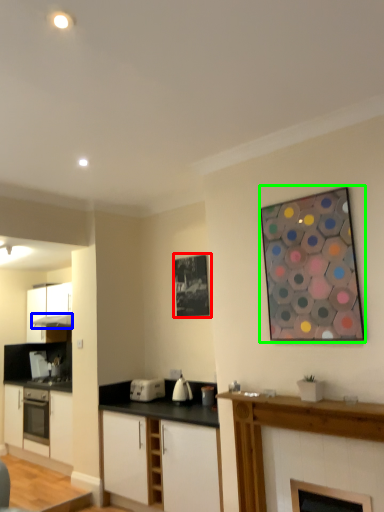
Question: Which object is the closest to the picture frame (highlighted by a red box)? Choose among these: exhaust hood (highlighted by a blue box) or picture frame (highlighted by a green box).

Choices:
 (A) exhaust hood
 (B) picture frame

Answer: (B)